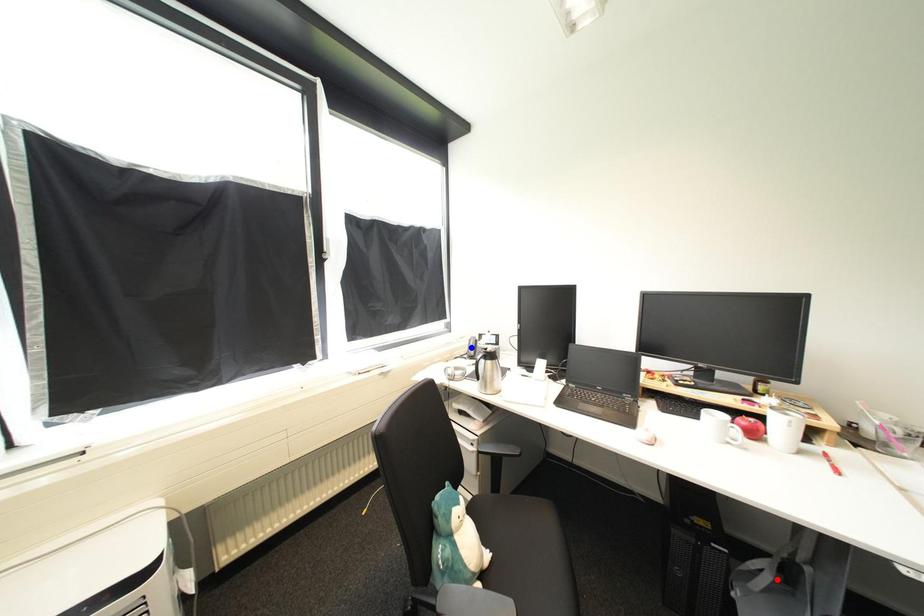
Question: Which of the two points in the image is closer to the camera?

Choices:
 (A) Blue point is closer.
 (B) Red point is closer.

Answer: (B)